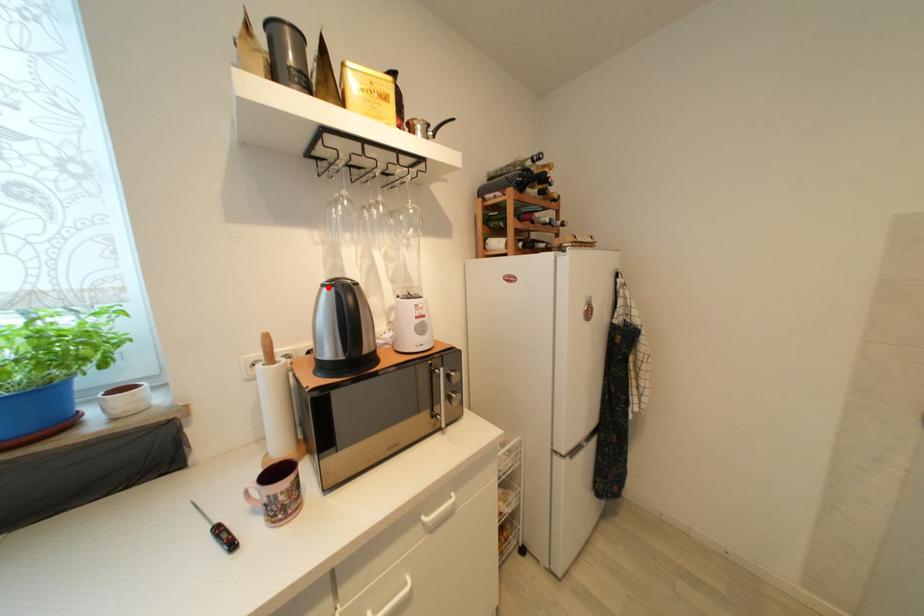
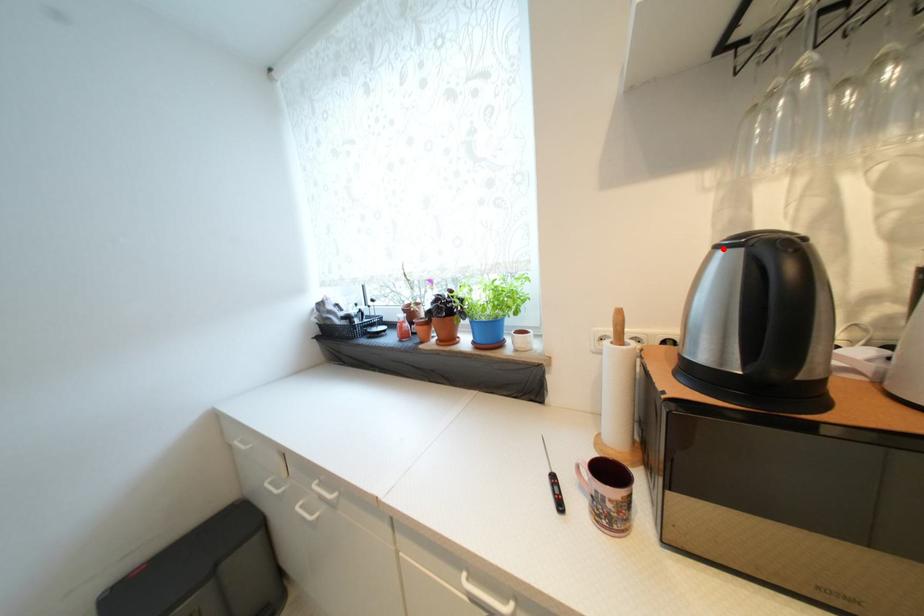
I am providing you with two images of the same scene from different viewpoints. A red point is marked on the first image and another point is marked on the second image. Are the points marked in image1 and image2 representing the same 3D position?

Yes